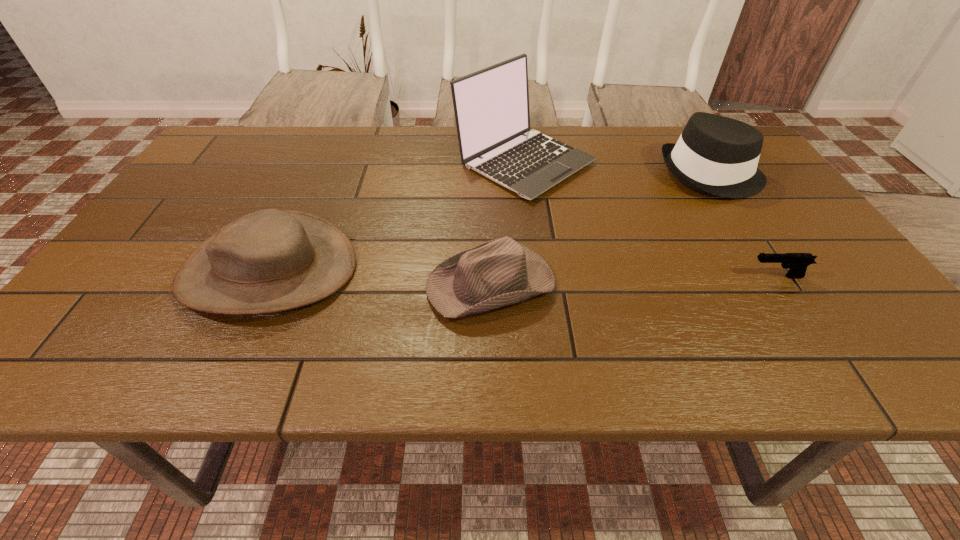
In the image, there is a desktop. At what (x,y) coordinates should I click in order to perform the action: click on free region at the far edge. Please return your answer as a coordinate pair (x, y). The image size is (960, 540). Looking at the image, I should click on (300, 127).

In the image, there is a desktop. Where is `blank space at the left edge`? Image resolution: width=960 pixels, height=540 pixels. blank space at the left edge is located at coordinates (150, 256).

In the image, there is a desktop. At what (x,y) coordinates should I click in order to perform the action: click on vacant space at the right edge. Please return your answer as a coordinate pair (x, y). Looking at the image, I should click on (771, 239).

Find the location of a particular element. The image size is (960, 540). vacant space at the far left corner is located at coordinates (272, 142).

I want to click on free space between the nearer fedora and the second tallest object, so click(x=601, y=229).

Where is `vacant point located between the second tallest object and the shortest object`? vacant point located between the second tallest object and the shortest object is located at coordinates (744, 225).

At what (x,y) coordinates should I click in order to perform the action: click on vacant space that's between the shorter fedora and the right fedora. Please return your answer as a coordinate pair (x, y). Looking at the image, I should click on (601, 229).

Find the location of a particular element. free spot between the laptop_computer and the taller fedora is located at coordinates (618, 168).

I want to click on free space between the leftmost object and the nearer fedora, so click(379, 276).

Where is `vacant area that lies between the tallest object and the left fedora`? vacant area that lies between the tallest object and the left fedora is located at coordinates (x=508, y=222).